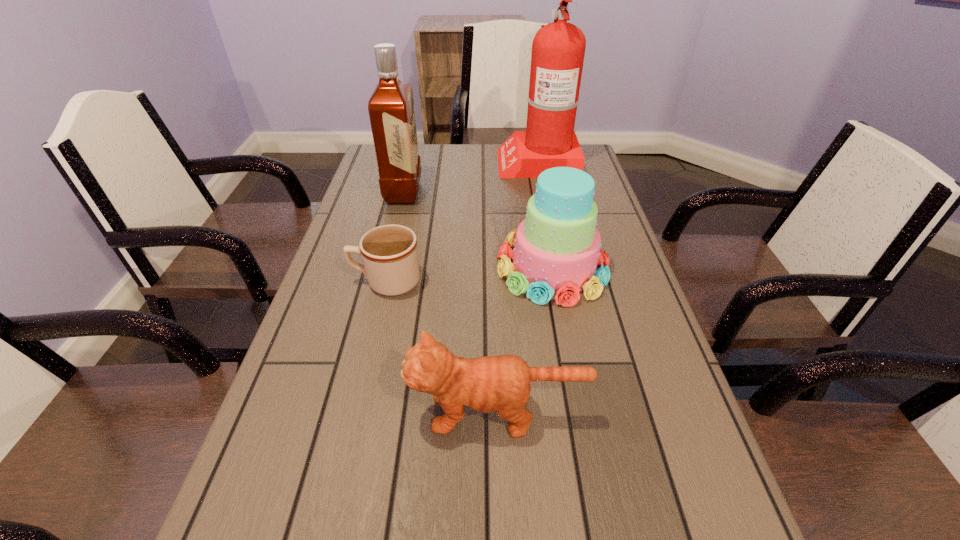
I want to click on the farthest object, so (x=558, y=49).

Locate an element on the screen. The height and width of the screenshot is (540, 960). the tallest object is located at coordinates (558, 49).

What are the coordinates of `the second tallest object` in the screenshot? It's located at (391, 107).

At what (x,y) coordinates should I click in order to perform the action: click on the second farthest object. Please return your answer as a coordinate pair (x, y). This screenshot has height=540, width=960. Looking at the image, I should click on (391, 107).

Locate an element on the screen. The image size is (960, 540). cake is located at coordinates (557, 248).

Locate an element on the screen. The image size is (960, 540). the nearest object is located at coordinates (501, 383).

Locate an element on the screen. The image size is (960, 540). the fourth tallest object is located at coordinates (501, 383).

This screenshot has width=960, height=540. I want to click on mug, so click(389, 252).

The height and width of the screenshot is (540, 960). What are the coordinates of `free region located 0.070m on the front-facing side of the farthest object` in the screenshot? It's located at [x=478, y=161].

Where is `free space located on the front-facing side of the farthest object`? free space located on the front-facing side of the farthest object is located at coordinates (445, 161).